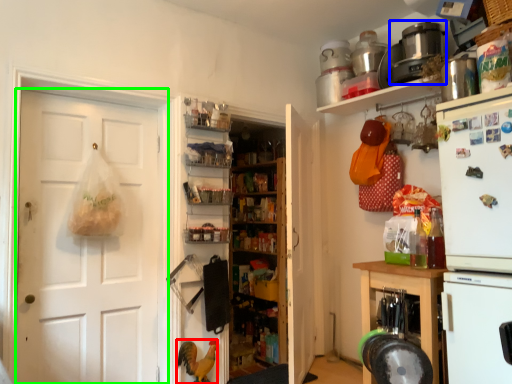
Question: Which is farther away from chicken (highlighted by a red box)? appliance (highlighted by a blue box) or door (highlighted by a green box)?

Choices:
 (A) appliance
 (B) door

Answer: (A)